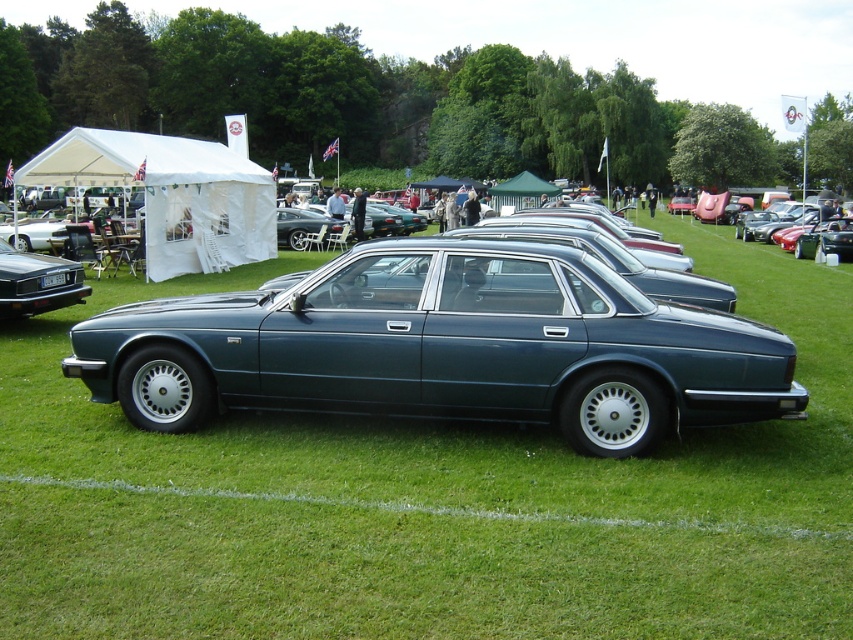
From the picture: Is metallic blue car at center shorter than black plastic license plate at center?

No, metallic blue car at center is not shorter than black plastic license plate at center.

Image resolution: width=853 pixels, height=640 pixels. Describe the element at coordinates (444, 348) in the screenshot. I see `metallic blue car at center` at that location.

Identify the location of metallic blue car at center. point(444,348).

Does metallic blue car at center have a greater width compared to matte black car at left?

Yes.

Between metallic blue car at center and matte black car at left, which one appears on the left side from the viewer's perspective?

From the viewer's perspective, matte black car at left appears more on the left side.

Between point (650, 417) and point (13, 260), which one is positioned behind?

Positioned behind is point (13, 260).

Identify the location of metallic blue car at center. (444, 348).

In order to click on metallic blue car at center in this screenshot , I will do `click(444, 348)`.

Is point (397, 289) positioned in front of point (796, 253)?

Yes, it is in front of point (796, 253).

Is point (253, 344) positioned after point (830, 221)?

No, it is not.

Locate an element on the screen. metallic blue car at center is located at coordinates (444, 348).